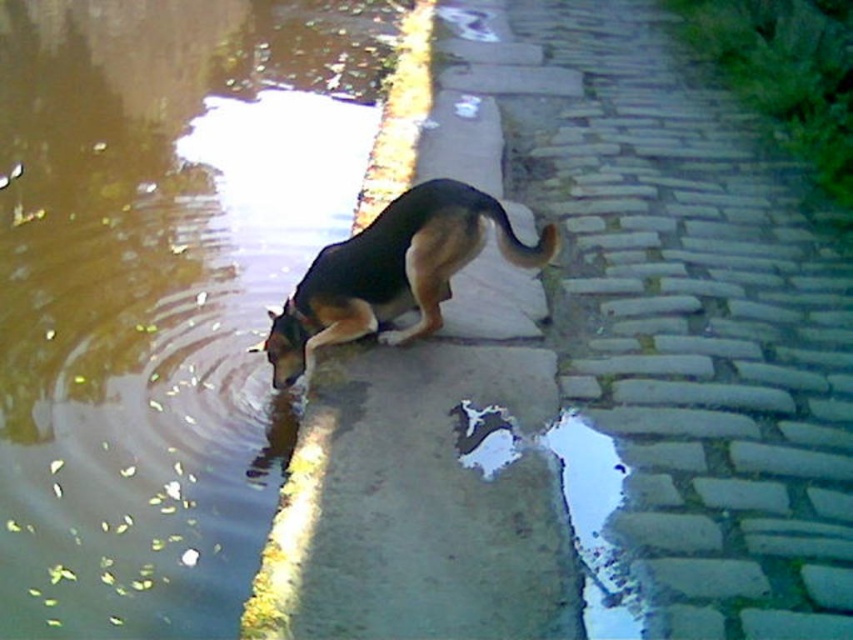
You are a photographer trying to capture the black and tan fur dog at center and the brown water at edge left in a single shot. Based on their heights, which object will appear closer to the camera in the photo?

The black and tan fur dog at center appears closer to the camera because it has a greater height than the brown water at edge left.

You are standing at the point marked by the coordinates point (160,289). Looking around, you see brown water at edge left. Which direction should you walk to move away from the brown water at edge left?

To move away from the brown water at edge left, you should walk to the right since the point (160,289) is at the edge left of the brown water, indicating that the right direction leads away from it.

You are a gardener who needs to water the plants near the brown water at edge left and the brick pavement at center. Since you have a limited amount of water, which area should you prioritize watering first based on their positions?

The brown water at edge left is to the left of the brick pavement at center, so you should prioritize watering the area near the brick pavement at center first since it is closer to the water source.